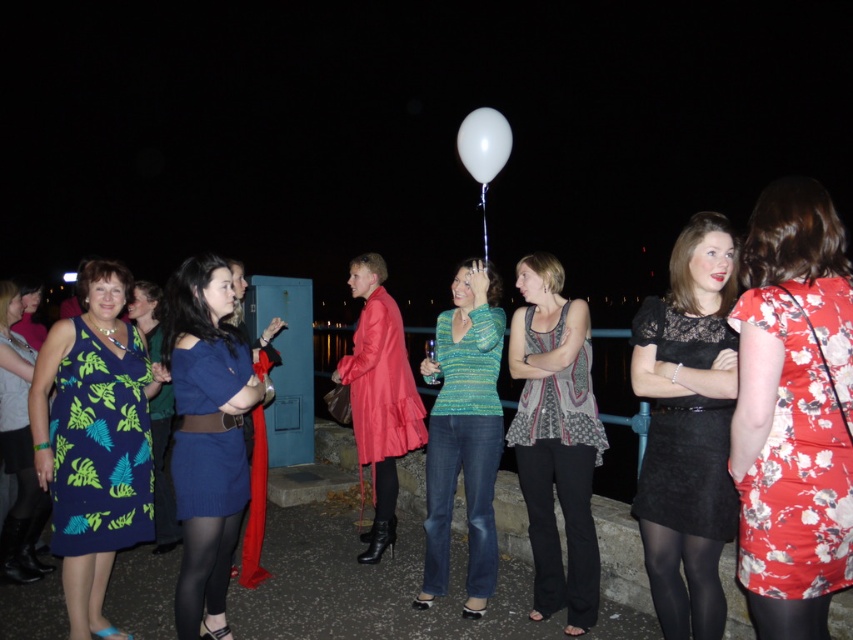
In the nighttime waterfront gathering, there are two dresses at the center of the image. Which one is positioned to the right of the other? The floral dress at center and the blue knitted dress at center are both present. Could you identify their relative positions?

The floral dress at center is positioned to the right of the blue knitted dress at center.

You are standing at the center of the image and want to move towards the point located at coordinates (793, 412). Which object will you be moving towards?

The point at coordinates (793, 412) is on the floral dress at center, so you will be moving towards the floral dress at center.

Looking at this image, you are organizing a charity event and need to ensure that all attendees are visible in photos. The floral dress at center and the black sheer tights at lower right are part of the outfit. Which item would be more noticeable in the photos taken at night?

The floral dress at center would be more noticeable in the photos because it has a larger size compared to the black sheer tights at lower right, making it stand out more in the dark environment.